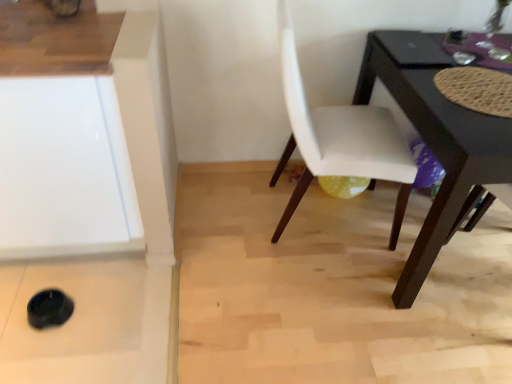
What do you see at coordinates (434, 137) in the screenshot? I see `glossy black table at lower right` at bounding box center [434, 137].

This screenshot has height=384, width=512. Find the location of `glossy black table at lower right`. glossy black table at lower right is located at coordinates (434, 137).

What do you see at coordinates (339, 139) in the screenshot?
I see `white leather chair at center` at bounding box center [339, 139].

Find the location of a particular element. Image resolution: width=512 pixels, height=384 pixels. white glossy cabinet at lower left is located at coordinates (62, 137).

Is white leather chair at center taller or shorter than white glossy cabinet at lower left?

In the image, white leather chair at center appears to be taller than white glossy cabinet at lower left.

Can you tell me how much white leather chair at center and white glossy cabinet at lower left differ in facing direction?

The angular difference between white leather chair at center and white glossy cabinet at lower left is 82.8 degrees.

Which point is more forward, (393,178) or (122,215)?

The point (122,215) is more forward.

From a real-world perspective, is white leather chair at center below white glossy cabinet at lower left?

Incorrect, from a real-world perspective, white leather chair at center is higher than white glossy cabinet at lower left.

Would you say glossy black table at lower right is outside white glossy cabinet at lower left?

Indeed, glossy black table at lower right is completely outside white glossy cabinet at lower left.

From a real-world perspective, is glossy black table at lower right positioned above or below white glossy cabinet at lower left?

From a real-world perspective, glossy black table at lower right is physically below white glossy cabinet at lower left.

From the image's perspective, is glossy black table at lower right located above white glossy cabinet at lower left?

No, from the image's perspective, glossy black table at lower right is not on top of white glossy cabinet at lower left.

What's the angular difference between glossy black table at lower right and white glossy cabinet at lower left's facing directions?

There is a 0.398-degree angle between the facing directions of glossy black table at lower right and white glossy cabinet at lower left.

The width and height of the screenshot is (512, 384). In order to click on cabinetry that is under the white leather chair at center (from a real-world perspective) in this screenshot , I will do `click(62, 137)`.

Do you think white glossy cabinet at lower left is within white leather chair at center, or outside of it?

white glossy cabinet at lower left is located beyond the bounds of white leather chair at center.

Which of these two, white glossy cabinet at lower left or white leather chair at center, is bigger?

white glossy cabinet at lower left.

Is point (72, 156) closer or farther from the camera than point (432, 264)?

Point (72, 156) is closer to the camera than point (432, 264).

Is white glossy cabinet at lower left shorter than glossy black table at lower right?

No, white glossy cabinet at lower left is not shorter than glossy black table at lower right.

Considering the sizes of objects white glossy cabinet at lower left and glossy black table at lower right in the image provided, who is thinner, white glossy cabinet at lower left or glossy black table at lower right?

With smaller width is white glossy cabinet at lower left.

Considering the relative positions of glossy black table at lower right and white leather chair at center in the image provided, is glossy black table at lower right to the left or to the right of white leather chair at center?

From the image, it's evident that glossy black table at lower right is to the right of white leather chair at center.

How many degrees apart are the facing directions of glossy black table at lower right and white leather chair at center?

glossy black table at lower right and white leather chair at center are facing 83.2 degrees away from each other.

From the image's perspective, is glossy black table at lower right located above or below white leather chair at center?

glossy black table at lower right is below white leather chair at center.

Could you tell me if white leather chair at center is facing glossy black table at lower right?

Yes, white leather chair at center is facing glossy black table at lower right.

Consider the image. From the image's perspective, is white leather chair at center under glossy black table at lower right?

Incorrect, from the image's perspective, white leather chair at center is higher than glossy black table at lower right.

Looking at this image, considering the sizes of objects white leather chair at center and glossy black table at lower right in the image provided, who is thinner, white leather chair at center or glossy black table at lower right?

With smaller width is white leather chair at center.

Considering the points (396, 151) and (508, 141), which point is in front, point (396, 151) or point (508, 141)?

Point (508, 141)

At what (x,y) coordinates should I click in order to perform the action: click on chair located on the right of white glossy cabinet at lower left. Please return your answer as a coordinate pair (x, y). Looking at the image, I should click on [x=339, y=139].

Where is `cabinetry that is above the glossy black table at lower right (from the image's perspective)`? Image resolution: width=512 pixels, height=384 pixels. cabinetry that is above the glossy black table at lower right (from the image's perspective) is located at coordinates (62, 137).

Which object lies nearer to the anchor point white glossy cabinet at lower left, glossy black table at lower right or white leather chair at center?

white leather chair at center.

Based on their spatial positions, is white glossy cabinet at lower left or glossy black table at lower right further from white leather chair at center?

white glossy cabinet at lower left is further to white leather chair at center.

From the image, which object appears to be nearer to white glossy cabinet at lower left, white leather chair at center or glossy black table at lower right?

Based on the image, white leather chair at center appears to be nearer to white glossy cabinet at lower left.

Estimate the real-world distances between objects in this image. Which object is further from glossy black table at lower right, white leather chair at center or white glossy cabinet at lower left?

The object further to glossy black table at lower right is white glossy cabinet at lower left.

Considering their positions, is white glossy cabinet at lower left positioned closer to glossy black table at lower right than white leather chair at center?

white leather chair at center.

Based on their spatial positions, is glossy black table at lower right or white glossy cabinet at lower left further from white leather chair at center?

white glossy cabinet at lower left lies further to white leather chair at center than the other object.

The height and width of the screenshot is (384, 512). What are the coordinates of `chair located between white glossy cabinet at lower left and glossy black table at lower right in the left-right direction` in the screenshot? It's located at (339, 139).